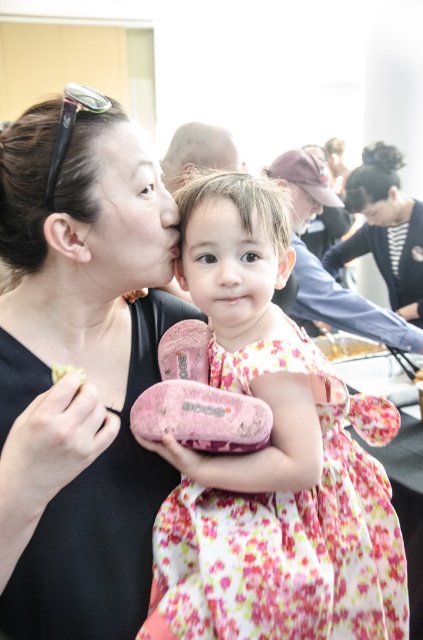
Question: Is pink fabric dress at center positioned in front of green matte food at lower left?

Choices:
 (A) no
 (B) yes

Answer: (A)

Question: Which point is farther to the camera?

Choices:
 (A) (373, 202)
 (B) (263, 330)

Answer: (A)

Question: Which point is closer to the camera?

Choices:
 (A) (397, 227)
 (B) (260, 573)

Answer: (B)

Question: Which point is closer to the camera taking this photo?

Choices:
 (A) (54, 364)
 (B) (408, 200)
 (C) (176, 525)
 (D) (209, 220)

Answer: (A)

Question: Does matte black dress at left appear on the left side of matte skin face at center?

Choices:
 (A) no
 (B) yes

Answer: (B)

Question: Does black textured hair at upper center have a smaller size compared to green matte food at lower left?

Choices:
 (A) yes
 (B) no

Answer: (B)